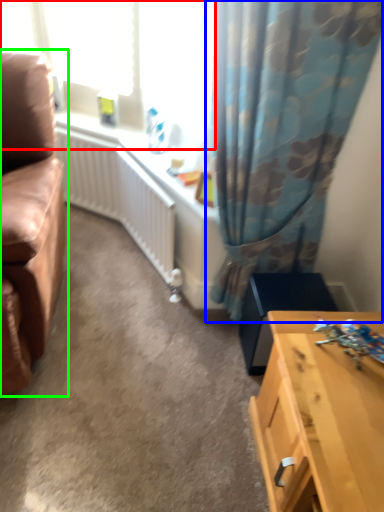
Question: Estimate the real-world distances between objects in this image. Which object is farther from window screen (highlighted by a red box), curtain (highlighted by a blue box) or studio couch (highlighted by a green box)?

Choices:
 (A) curtain
 (B) studio couch

Answer: (B)